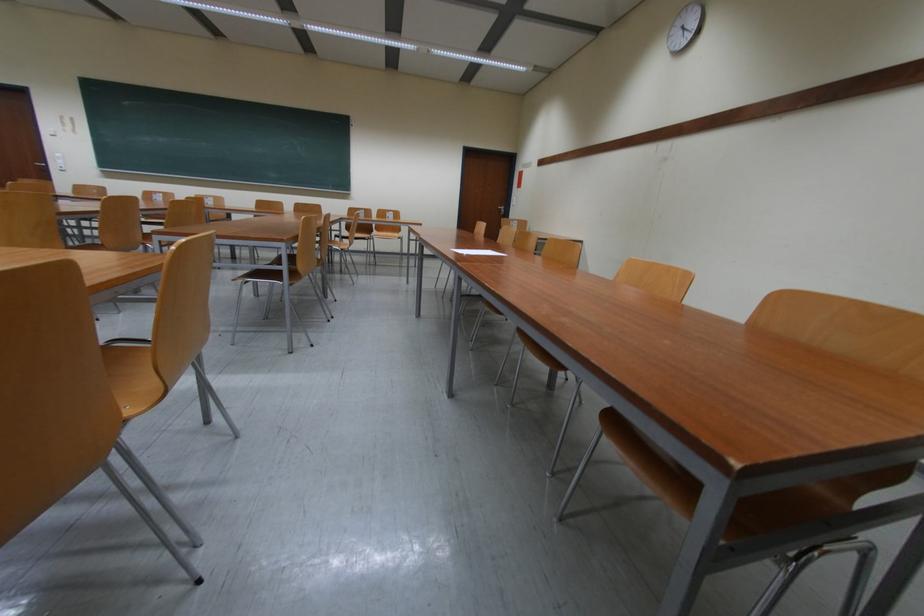
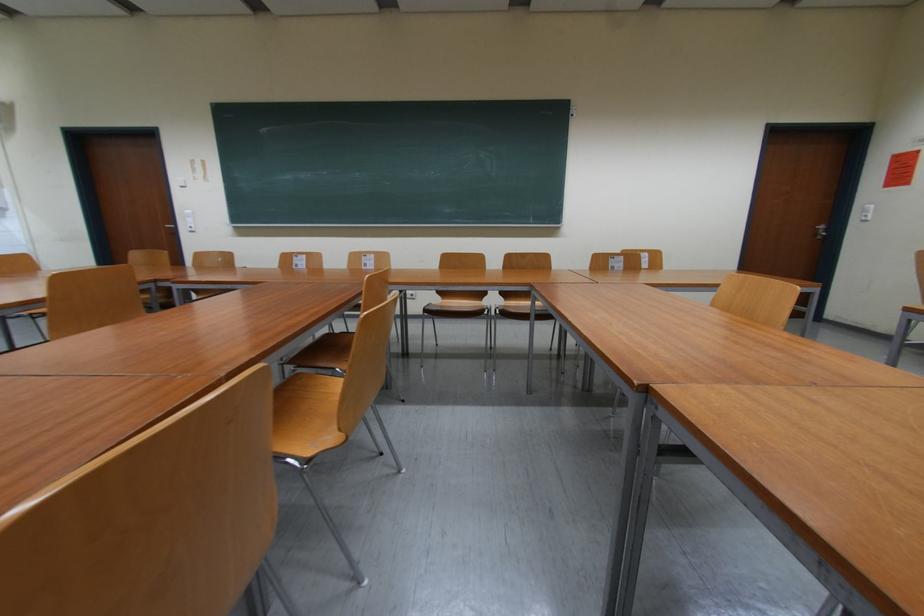
What movement of the cameraman would produce the second image?

The cameraman moved toward left, forward.